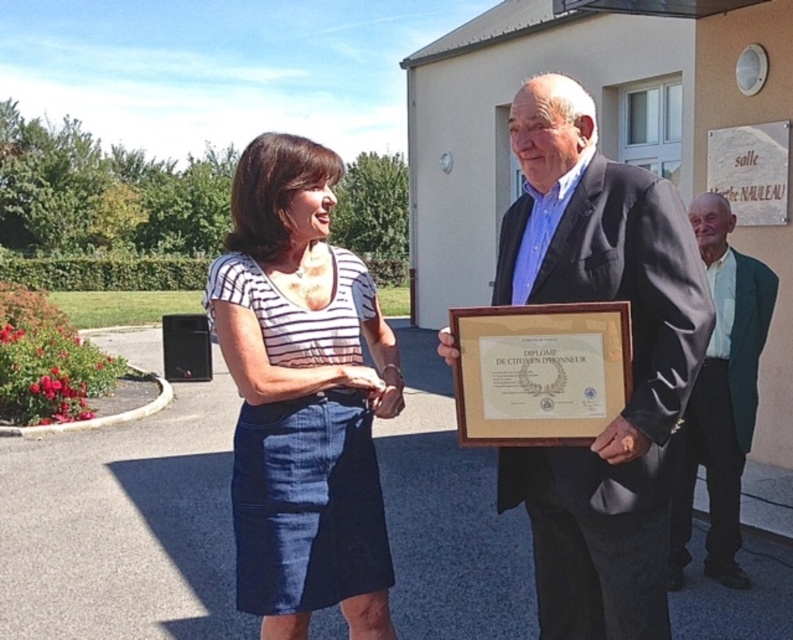
Question: Among these objects, which one is farthest from the camera?

Choices:
 (A) striped cotton shirt at center
 (B) matte black suit at center
 (C) green textured blazer at lower right

Answer: (C)

Question: Is matte black suit at center above striped cotton shirt at center?

Choices:
 (A) no
 (B) yes

Answer: (B)

Question: Among these points, which one is farthest from the camera?

Choices:
 (A) (661, 284)
 (B) (680, 588)

Answer: (B)

Question: Is striped cotton shirt at center bigger than green textured blazer at lower right?

Choices:
 (A) no
 (B) yes

Answer: (A)

Question: Can you confirm if matte black suit at center is smaller than green textured blazer at lower right?

Choices:
 (A) no
 (B) yes

Answer: (B)

Question: Which is farther from the matte black suit at center?

Choices:
 (A) striped cotton shirt at center
 (B) green textured blazer at lower right

Answer: (B)